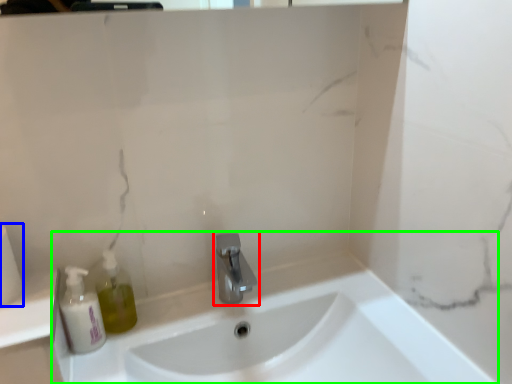
Question: Which object is positioned farthest from tap (highlighted by a red box)? Select from toilet paper (highlighted by a blue box) and sink (highlighted by a green box).

Choices:
 (A) toilet paper
 (B) sink

Answer: (A)